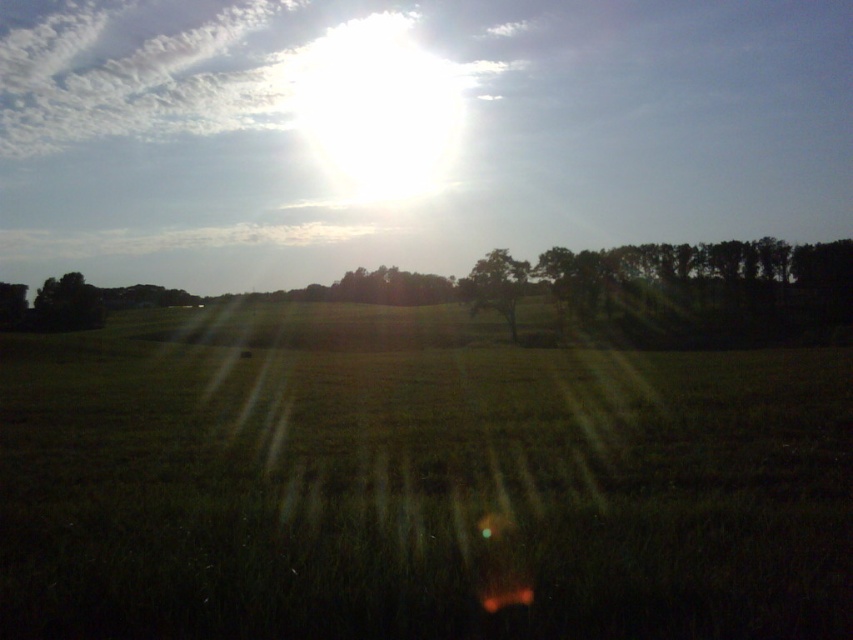
Is green leafy tree at center to the left of dark green leafy tree at left from the viewer's perspective?

No, green leafy tree at center is not to the left of dark green leafy tree at left.

Is green leafy tree at center smaller than dark green leafy tree at left?

Yes, green leafy tree at center is smaller than dark green leafy tree at left.

Does point (509, 253) lie behind point (96, 292)?

That is False.

This screenshot has width=853, height=640. I want to click on green leafy tree at center, so click(495, 285).

Does green grass at center come in front of dark green leafy tree at left?

Yes, green grass at center is in front of dark green leafy tree at left.

Who is taller, green grass at center or dark green leafy tree at left?

With more height is dark green leafy tree at left.

At what (x,y) coordinates should I click in order to perform the action: click on green grass at center. Please return your answer as a coordinate pair (x, y). This screenshot has width=853, height=640. Looking at the image, I should click on (415, 483).

Does green grass at center lie behind green leafy tree at center?

No, it is not.

Between point (344, 544) and point (473, 310), which one is positioned behind?

Point (473, 310)

Measure the distance between point [149,564] and camera.

They are 14.25 feet apart.

Identify the location of green grass at center. (415, 483).